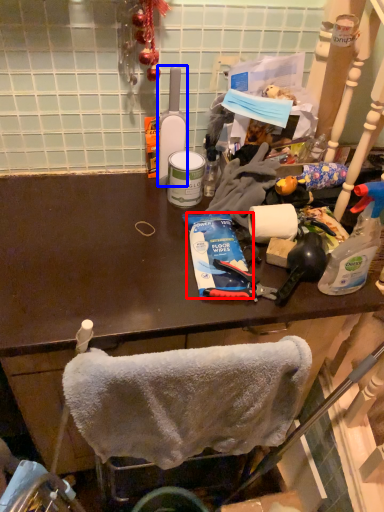
Question: Which object is closer to the camera taking this photo, toothpaste (highlighted by a red box) or bottle (highlighted by a blue box)?

Choices:
 (A) toothpaste
 (B) bottle

Answer: (A)